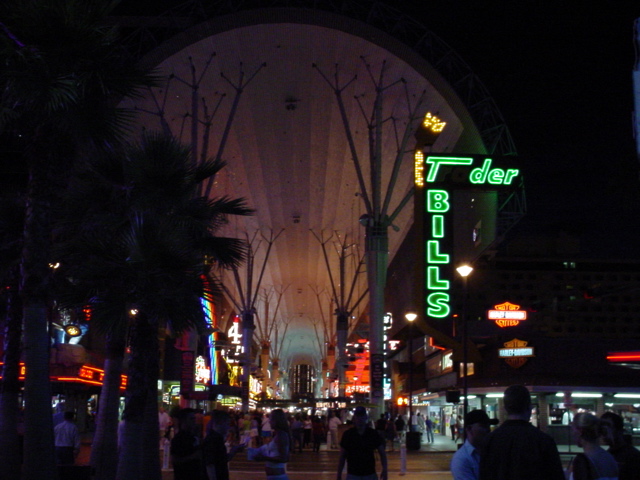
Where is `neon lights`? The width and height of the screenshot is (640, 480). neon lights is located at coordinates (92, 374), (230, 364), (367, 374).